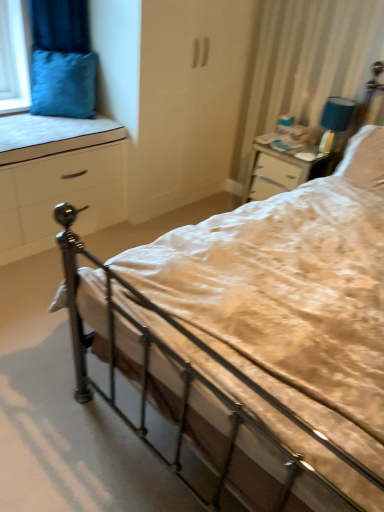
I want to click on vacant region above blue fabric lampshade at upper right (from a real-world perspective), so tap(354, 96).